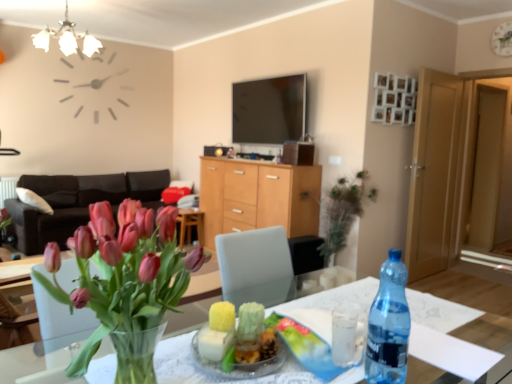
The image size is (512, 384). Describe the element at coordinates (124, 271) in the screenshot. I see `pink glass vase at lower left` at that location.

Measure the distance between pink glass vase at lower left and camera.

pink glass vase at lower left and camera are 31.80 inches apart from each other.

The image size is (512, 384). Find the location of `dark brown leather couch at left`. dark brown leather couch at left is located at coordinates (77, 203).

What do you see at coordinates (216, 150) in the screenshot? I see `matte black phone at center` at bounding box center [216, 150].

I want to click on wooden side table at center, so click(x=190, y=225).

This screenshot has width=512, height=384. What are the coordinates of `wooden cabinet at center` in the screenshot? It's located at (258, 197).

Identify the location of pink glass vase at lower left. The height and width of the screenshot is (384, 512). (124, 271).

Would you say transparent glass door at right, positioned as the second glass door in left-to-right order, is inside or outside light brown wooden door at right, the 2th glass door viewed from the right?

transparent glass door at right, positioned as the second glass door in left-to-right order, cannot be found inside light brown wooden door at right, the 2th glass door viewed from the right.

You are a GUI agent. You are given a task and a screenshot of the screen. Output one action in this format:
    pyautogui.click(x=<x>, y=<y>)
    Task: Click on the glass door below the transparent glass door at right, which is the first glass door from right to left (from a real-world perspective)
    
    Given the screenshot: What is the action you would take?
    pyautogui.click(x=434, y=174)

Is transparent glass door at right, which is the first glass door from right to left, looking in the opposite direction of light brown wooden door at right, marked as the first glass door in a left-to-right arrangement?

No, transparent glass door at right, which is the first glass door from right to left, is not facing away from light brown wooden door at right, marked as the first glass door in a left-to-right arrangement.

From a real-world perspective, between transparent glass door at right, which is the first glass door from right to left, and light brown wooden door at right, marked as the first glass door in a left-to-right arrangement, who is vertically lower?

From a 3D spatial view, light brown wooden door at right, marked as the first glass door in a left-to-right arrangement, is below.

Which of these two, pink glass vase at lower left or dark brown leather couch at left, is wider?

dark brown leather couch at left is wider.

Who is smaller, pink glass vase at lower left or dark brown leather couch at left?

Smaller between the two is pink glass vase at lower left.

Based on their positions, is pink glass vase at lower left located to the left or right of dark brown leather couch at left?

In the image, pink glass vase at lower left appears on the right side of dark brown leather couch at left.

Does wooden side table at center appear on the left side of clear glass vase at center?

Yes, wooden side table at center is to the left of clear glass vase at center.

Is wooden side table at center closer to the viewer compared to clear glass vase at center?

No, it is not.

Is wooden side table at center bigger or smaller than clear glass vase at center?

Considering their sizes, wooden side table at center takes up less space than clear glass vase at center.

Is wooden side table at center not inside clear glass vase at center?

wooden side table at center lies outside clear glass vase at center's area.

The width and height of the screenshot is (512, 384). I want to click on floral arrangement lying in front of the green leafy plant at center, so click(124, 271).

Is pink glass vase at lower left turned away from green leafy plant at center?

No, green leafy plant at center is not at the back of pink glass vase at lower left.

Consider the image. From a real-world perspective, is pink glass vase at lower left physically located above or below green leafy plant at center?

Clearly, from a real-world perspective, pink glass vase at lower left is above green leafy plant at center.

From the picture: Does pink glass vase at lower left have a lesser width compared to green leafy plant at center?

Incorrect, the width of pink glass vase at lower left is not less than that of green leafy plant at center.

Is clear glass vase at center positioned far away from transparent glass door at right, which is the first glass door from right to left?

clear glass vase at center is far away from transparent glass door at right, which is the first glass door from right to left.

Does point (6, 371) come farther from viewer compared to point (493, 97)?

That is False.

Between clear glass vase at center and transparent glass door at right, which is the first glass door from right to left, which one has more height?

Standing taller between the two is transparent glass door at right, which is the first glass door from right to left.

Could you tell me if clear glass vase at center is facing transparent glass door at right, positioned as the second glass door in left-to-right order?

No.

Would you say dark brown leather couch at left is outside wooden cabinet at center?

Yes.

Is dark brown leather couch at left looking in the opposite direction of wooden cabinet at center?

dark brown leather couch at left does not have its back to wooden cabinet at center.

From the picture: Is dark brown leather couch at left bigger than wooden cabinet at center?

Correct, dark brown leather couch at left is larger in size than wooden cabinet at center.

From the image's perspective, relative to wooden cabinet at center, is dark brown leather couch at left above or below?

Clearly, from the image's perspective, dark brown leather couch at left is above wooden cabinet at center.

Does matte black phone at center have a lesser height compared to pink glass vase at lower left?

Yes, matte black phone at center is shorter than pink glass vase at lower left.

From the picture: Is matte black phone at center bigger or smaller than pink glass vase at lower left?

matte black phone at center is smaller than pink glass vase at lower left.

Is matte black phone at center turned away from pink glass vase at lower left?

matte black phone at center is not turned away from pink glass vase at lower left.

The width and height of the screenshot is (512, 384). What are the coordinates of `glass door above the light brown wooden door at right, the 2th glass door viewed from the right (from the image's perspective)` in the screenshot? It's located at (490, 176).

At what (x,y) coordinates should I click in order to perform the action: click on studio couch behind the pink glass vase at lower left. Please return your answer as a coordinate pair (x, y). Looking at the image, I should click on (77, 203).

Looking at this image, from the image, which object appears to be farther from clear glass vase at center, matte black phone at center or transparent plastic bottle at table right?

transparent plastic bottle at table right is positioned further to the anchor clear glass vase at center.

Considering their positions, is matte black phone at center positioned further to light brown wooden door at right, the 2th glass door viewed from the right, than wooden side table at center?

wooden side table at center is further to light brown wooden door at right, the 2th glass door viewed from the right.

When comparing their distances from transparent glass door at right, which is the first glass door from right to left, does pink glass vase at lower left or white glass chandelier at upper left seem closer?

white glass chandelier at upper left is closer to transparent glass door at right, which is the first glass door from right to left.

Considering their positions, is transparent glass door at right, which is the first glass door from right to left, positioned further to white glass chandelier at upper left than clear glass vase at center?

transparent glass door at right, which is the first glass door from right to left.

From the image, which object appears to be farther from matte black phone at center, green leafy plant at center or wooden cabinet at center?

The object further to matte black phone at center is green leafy plant at center.

From the image, which object appears to be farther from dark brown leather couch at left, matte black phone at center or green leafy plant at center?

Among the two, green leafy plant at center is located further to dark brown leather couch at left.

Based on their spatial positions, is wooden cabinet at center or wooden side table at center further from pink glass vase at lower left?

The object further to pink glass vase at lower left is wooden side table at center.

Estimate the real-world distances between objects in this image. Which object is further from wooden side table at center, dark brown leather couch at left or clear glass vase at center?

clear glass vase at center is positioned further to the anchor wooden side table at center.

Locate an element on the screen. The height and width of the screenshot is (384, 512). bottle located between clear glass vase at center and white matte clock at upper center in the depth direction is located at coordinates (389, 325).

Locate an element on the screen. The width and height of the screenshot is (512, 384). corded phone between white glass chandelier at upper left and wooden cabinet at center from left to right is located at coordinates (216, 150).

Image resolution: width=512 pixels, height=384 pixels. Identify the location of clock located between transparent plastic bottle at table right and matte black phone at center in the depth direction. [x=502, y=39].

This screenshot has width=512, height=384. Identify the location of side table between wooden cabinet at center and matte black phone at center in the front-back direction. (190, 225).